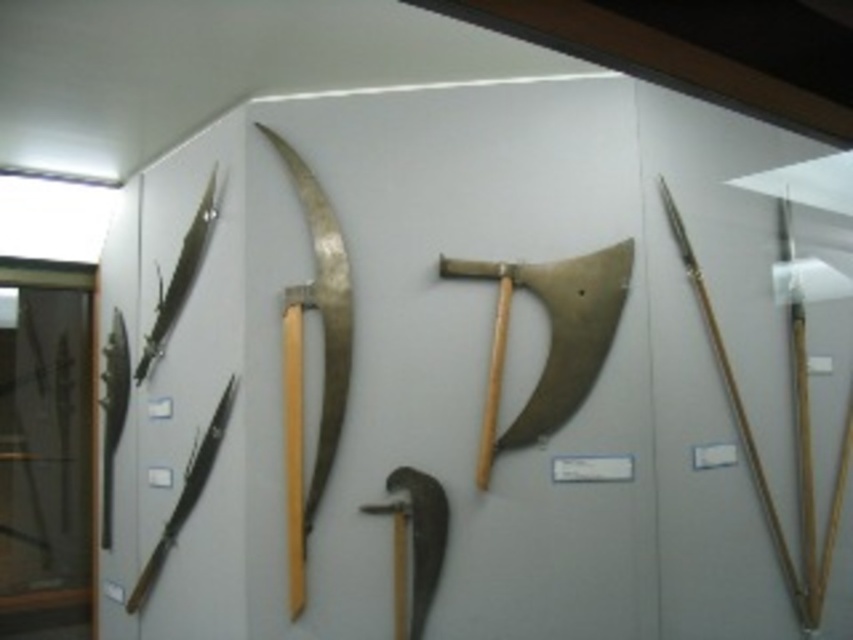
Between gold metallic axe at center and polished silver scythe at center, which one has more height?

polished silver scythe at center is taller.

Which is in front, point (560, 282) or point (318, 289)?

Point (560, 282)

At what (x,y) coordinates should I click in order to perform the action: click on gold metallic axe at center. Please return your answer as a coordinate pair (x, y). Looking at the image, I should click on pyautogui.click(x=550, y=337).

Who is lower down, gold metallic axe at center or polished silver sword at center?

polished silver sword at center is lower down.

Is gold metallic axe at center to the right of polished silver sword at center from the viewer's perspective?

Correct, you'll find gold metallic axe at center to the right of polished silver sword at center.

Is point (503, 264) closer to camera compared to point (399, 586)?

That is True.

This screenshot has height=640, width=853. What are the coordinates of `gold metallic axe at center` in the screenshot? It's located at (550, 337).

Does polished silver scythe at center have a greater width compared to wooden spear at right?

In fact, polished silver scythe at center might be narrower than wooden spear at right.

Is polished silver scythe at center to the left of wooden spear at right from the viewer's perspective?

Correct, you'll find polished silver scythe at center to the left of wooden spear at right.

Measure the distance between polished silver scythe at center and camera.

polished silver scythe at center is 2.76 meters from camera.

Identify the location of polished silver scythe at center. This screenshot has width=853, height=640. pyautogui.click(x=300, y=358).